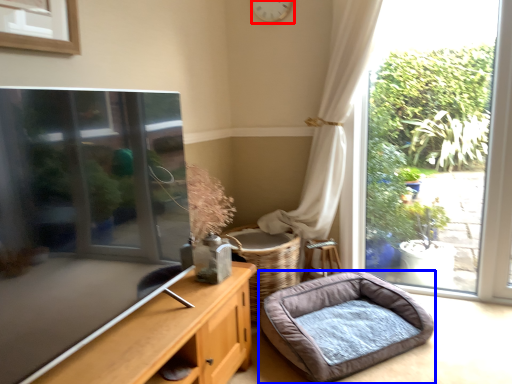
Question: Which object is closer to the camera taking this photo, clock (highlighted by a red box) or dog bed (highlighted by a blue box)?

Choices:
 (A) clock
 (B) dog bed

Answer: (B)